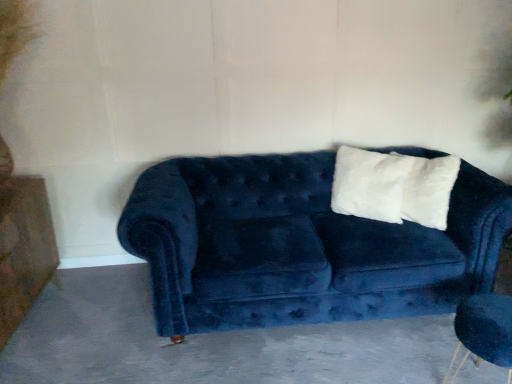
Question: Would you consider velvet blue couch at center to be distant from dark gray concrete at center?

Choices:
 (A) yes
 (B) no

Answer: (B)

Question: Is velvet blue couch at center completely or partially outside of dark gray concrete at center?

Choices:
 (A) yes
 (B) no

Answer: (A)

Question: Is velvet blue couch at center turned away from dark gray concrete at center?

Choices:
 (A) no
 (B) yes

Answer: (A)

Question: Does velvet blue couch at center have a lesser height compared to dark gray concrete at center?

Choices:
 (A) yes
 (B) no

Answer: (B)

Question: Is velvet blue couch at center further to the viewer compared to dark gray concrete at center?

Choices:
 (A) no
 (B) yes

Answer: (B)

Question: From a real-world perspective, is velvet blue couch at center located beneath dark gray concrete at center?

Choices:
 (A) yes
 (B) no

Answer: (B)

Question: Can you confirm if velvet blue couch at center is taller than velvet blue armchair at lower right?

Choices:
 (A) yes
 (B) no

Answer: (A)

Question: Could you tell me if velvet blue couch at center is turned towards velvet blue armchair at lower right?

Choices:
 (A) yes
 (B) no

Answer: (A)

Question: Is the position of velvet blue couch at center more distant than that of velvet blue armchair at lower right?

Choices:
 (A) no
 (B) yes

Answer: (B)

Question: Is velvet blue couch at center positioned in front of velvet blue armchair at lower right?

Choices:
 (A) yes
 (B) no

Answer: (B)

Question: Does velvet blue couch at center have a larger size compared to velvet blue armchair at lower right?

Choices:
 (A) no
 (B) yes

Answer: (B)

Question: From a real-world perspective, is velvet blue couch at center positioned over velvet blue armchair at lower right based on gravity?

Choices:
 (A) no
 (B) yes

Answer: (B)

Question: Can you confirm if white fluffy pillow at upper right is positioned to the right of velvet blue armchair at lower right?

Choices:
 (A) yes
 (B) no

Answer: (B)